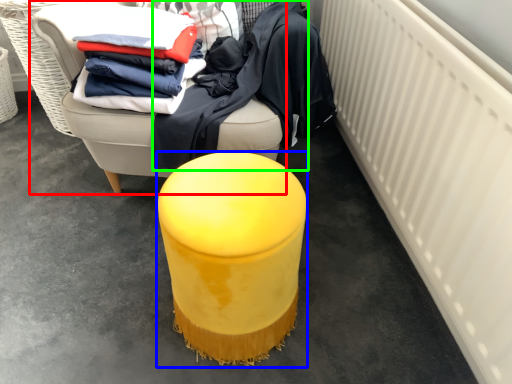
Question: Which object is positioned farthest from furniture (highlighted by a red box)? Select from furniture (highlighted by a blue box) and clothing (highlighted by a green box).

Choices:
 (A) furniture
 (B) clothing

Answer: (A)